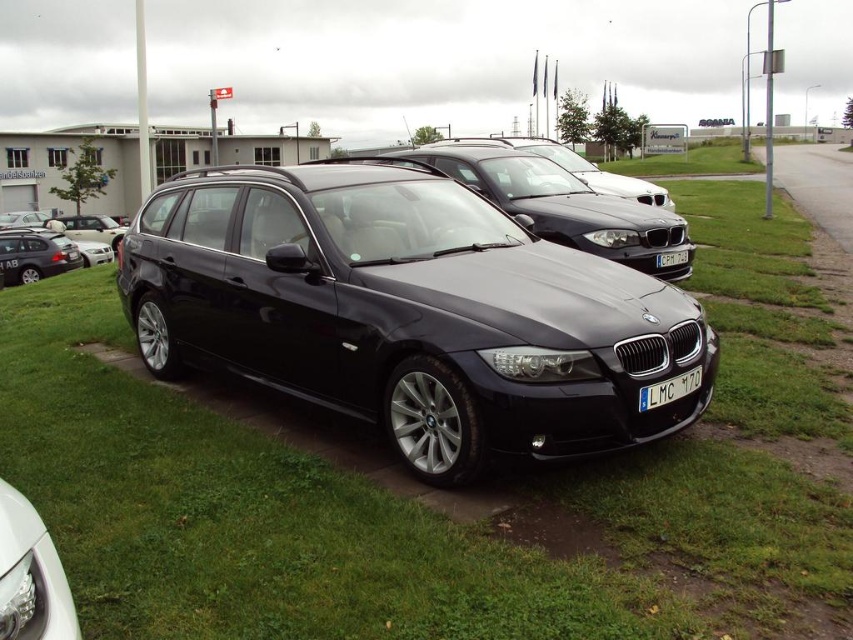
Question: Does gravel road at right have a lesser width compared to black plastic license plate at center?

Choices:
 (A) yes
 (B) no

Answer: (B)

Question: Which point appears farthest from the camera in this image?

Choices:
 (A) (115, 221)
 (B) (685, 376)
 (C) (834, 228)

Answer: (A)

Question: Which point is closer to the camera?

Choices:
 (A) matte black car at left
 (B) gravel road at right
 (C) matte black car at center
 (D) black metallic car at center

Answer: (D)

Question: Can you confirm if black metallic car at center is positioned above black plastic license plate at center?

Choices:
 (A) yes
 (B) no

Answer: (B)

Question: Among these points, which one is nearest to the camera?

Choices:
 (A) (660, 387)
 (B) (30, 246)
 (C) (660, 262)
 (D) (1, 572)

Answer: (D)

Question: Is black metallic car at center bigger than black plastic license plate at center?

Choices:
 (A) no
 (B) yes

Answer: (B)